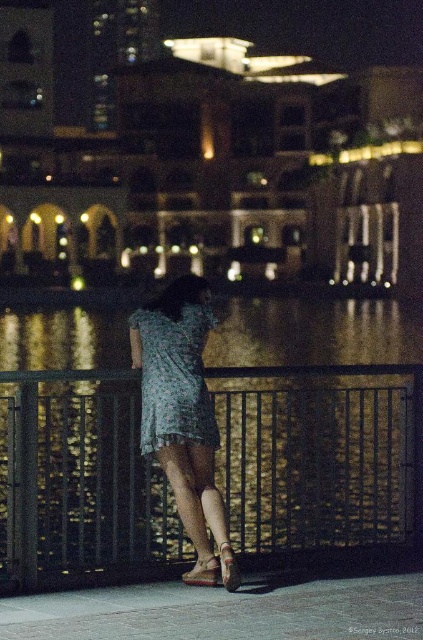
You are a photographer taking a picture of the waterfront scene. The black metal fence at center and the printed fabric dress at center are both in your frame. Based on their sizes in the image, which object is likely closer to you?

The printed fabric dress at center is closer to you because it is smaller than the black metal fence at center, which appears larger due to being taller in the scene.

You are a photographer trying to capture the woman in the printed fabric dress at center without including the black metal fence at center in the frame. Given their sizes, is this possible?

The black metal fence at center is larger in size than the printed fabric dress at center, so it might be challenging to frame the dress without including the fence. Adjust your angle or position to ensure the fence is out of the shot.

You are a photographer trying to capture a closeup shot of the printed fabric dress at center and the brown leather sandal at lower center in the same frame. Given that your camera has a minimum focusing distance of 2 meters, will you be able to achieve this shot?

The printed fabric dress at center and brown leather sandal at lower center are 1.98 meters apart from each other, which is less than the camera minimum focusing distance of 2 meters. Therefore, the camera cannot focus on both objects simultaneously, making it impossible to capture them clearly in the same frame.